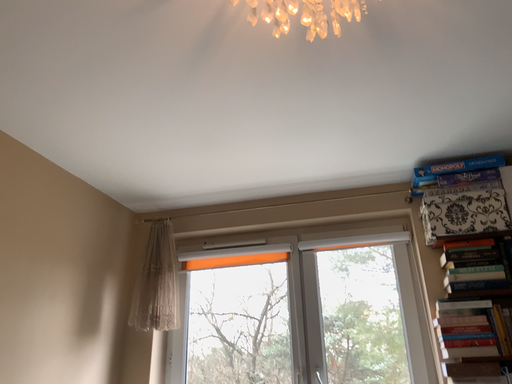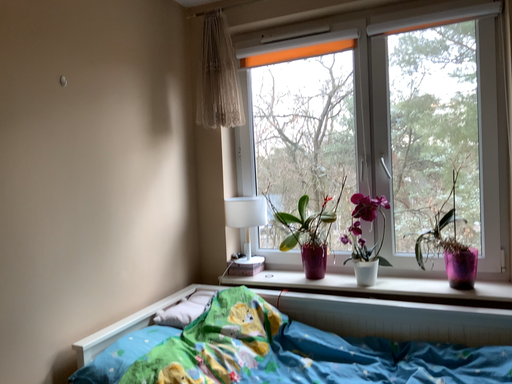
Question: Which way did the camera rotate in the video?

Choices:
 (A) rotated left
 (B) rotated right

Answer: (A)